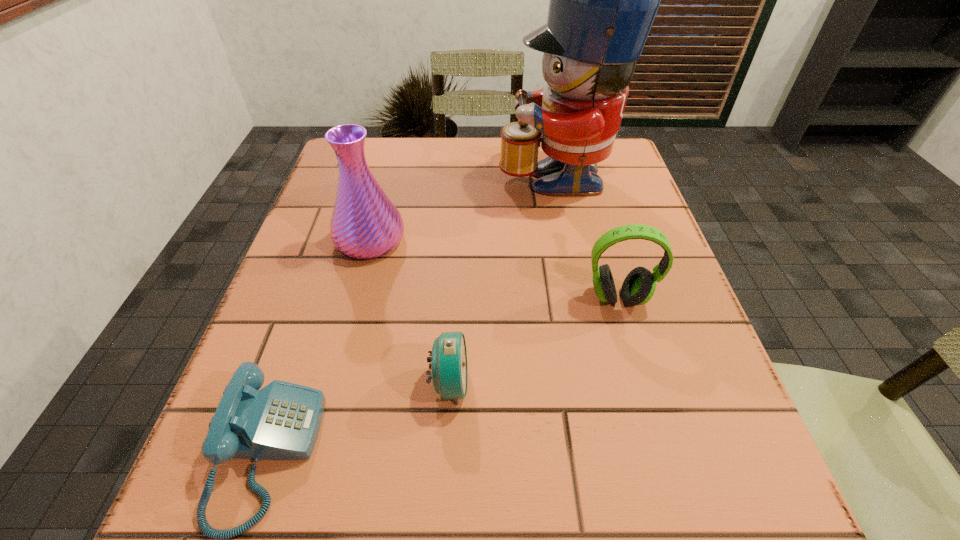
Locate an element on the screen. free space located on the front-facing side of the tallest object is located at coordinates (396, 173).

Locate an element on the screen. The height and width of the screenshot is (540, 960). free space located on the back of the second farthest object is located at coordinates (384, 187).

Find the location of `free location located on the left of the headset`. free location located on the left of the headset is located at coordinates (455, 298).

Locate an element on the screen. Image resolution: width=960 pixels, height=540 pixels. free space located on the front-facing side of the alarm clock is located at coordinates (543, 383).

Locate an element on the screen. The width and height of the screenshot is (960, 540). object situated at the far edge is located at coordinates (603, 1).

I want to click on object positioned at the left edge, so click(x=365, y=224).

I want to click on nutcracker that is at the right edge, so click(603, 1).

Locate an element on the screen. The height and width of the screenshot is (540, 960). headset at the right edge is located at coordinates (639, 286).

Where is `object that is at the far right corner`? This screenshot has width=960, height=540. object that is at the far right corner is located at coordinates (603, 1).

You are a GUI agent. You are given a task and a screenshot of the screen. Output one action in this format:
    pyautogui.click(x=<x>, y=<y>)
    Task: Click on the vacant space at the far edge
    This screenshot has width=960, height=540.
    Given the screenshot: What is the action you would take?
    pyautogui.click(x=459, y=166)